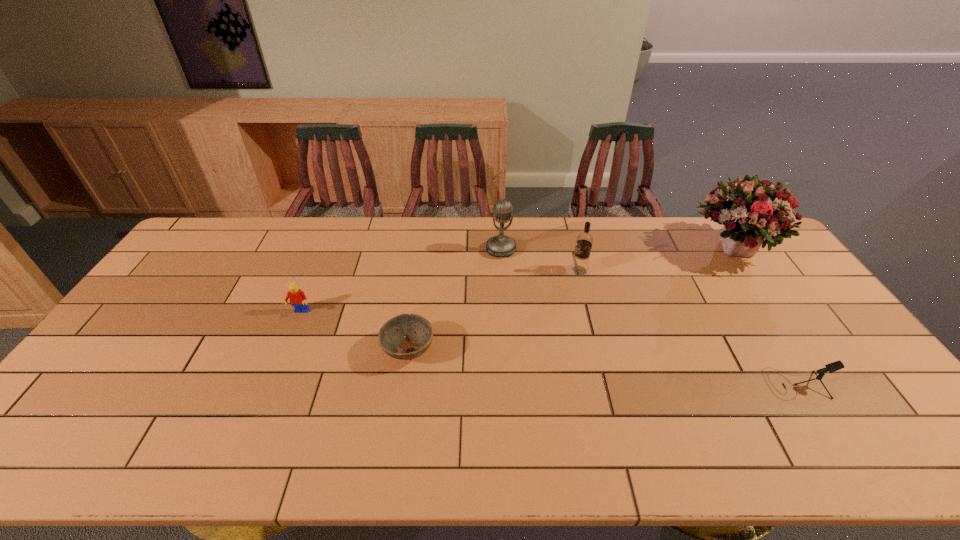
Find the location of a particular element. bouquet is located at coordinates pyautogui.click(x=753, y=212).

The image size is (960, 540). Identify the location of the left microphone. (500, 245).

Where is `the fourth object from right to left`? The image size is (960, 540). the fourth object from right to left is located at coordinates (500, 245).

This screenshot has width=960, height=540. Identify the location of vodka. (584, 241).

Identify the location of Lego. This screenshot has height=540, width=960. (297, 297).

In order to click on the fourth farthest object in this screenshot , I will do `click(297, 297)`.

The width and height of the screenshot is (960, 540). Identify the location of the second shortest object. (834, 366).

The image size is (960, 540). Identify the location of the right microphone. (834, 366).

The image size is (960, 540). I want to click on the shortest object, so click(416, 328).

Find the location of a particular element. the second object from left to right is located at coordinates point(416,328).